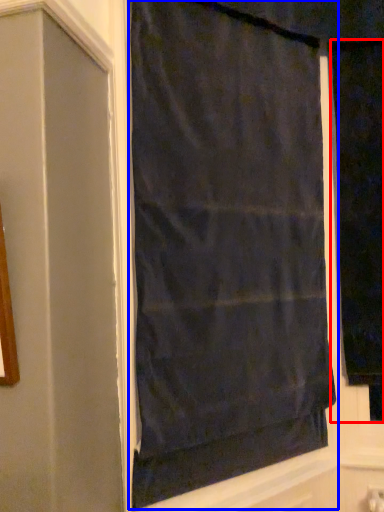
Question: Which point is closer to the camera, curtain (highlighted by a red box) or curtain (highlighted by a blue box)?

Choices:
 (A) curtain
 (B) curtain

Answer: (B)